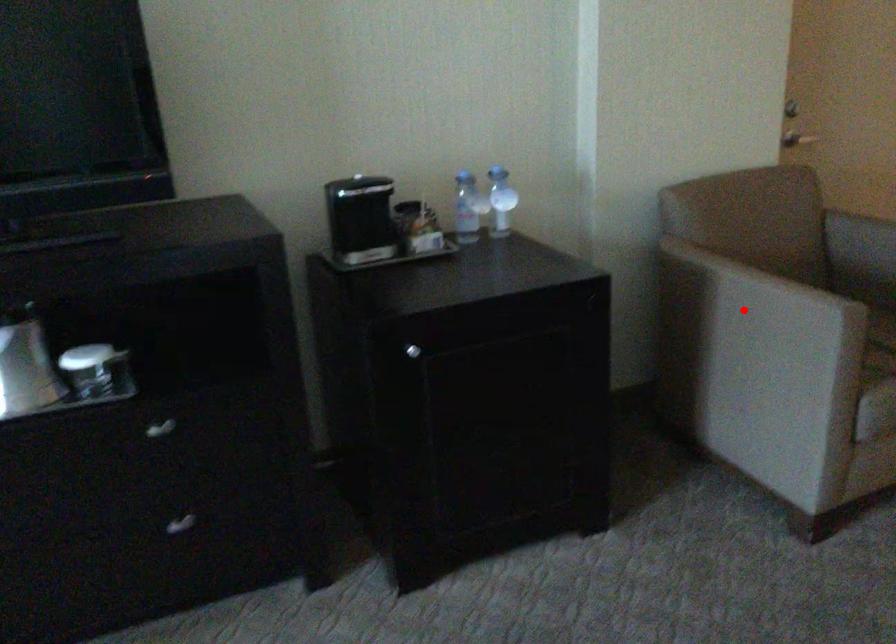
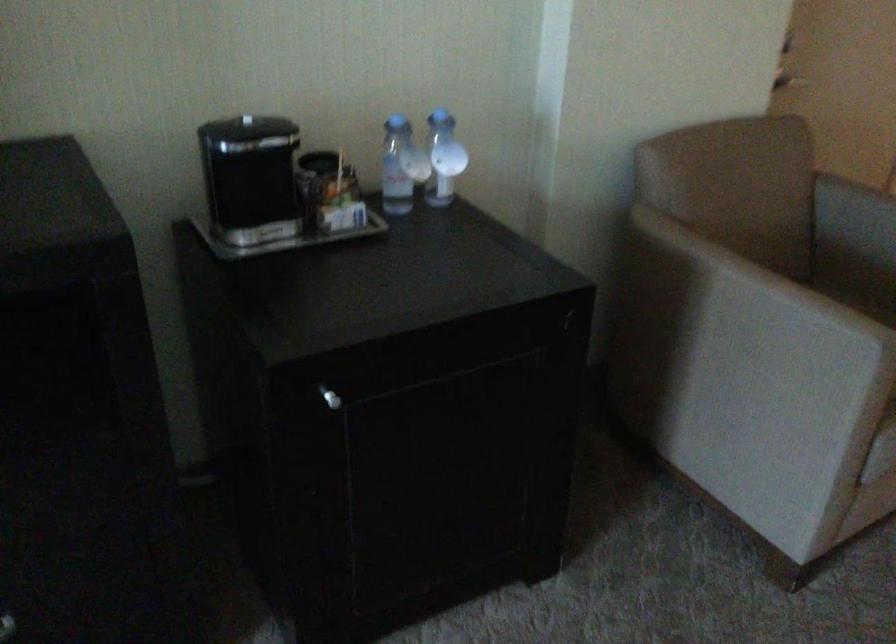
Question: I am providing you with two images of the same scene from different viewpoints. Given a red point in image1, look at the same physical point in image2. Is it:

Choices:
 (A) Closer to the viewpoint
 (B) Farther from the viewpoint

Answer: (A)